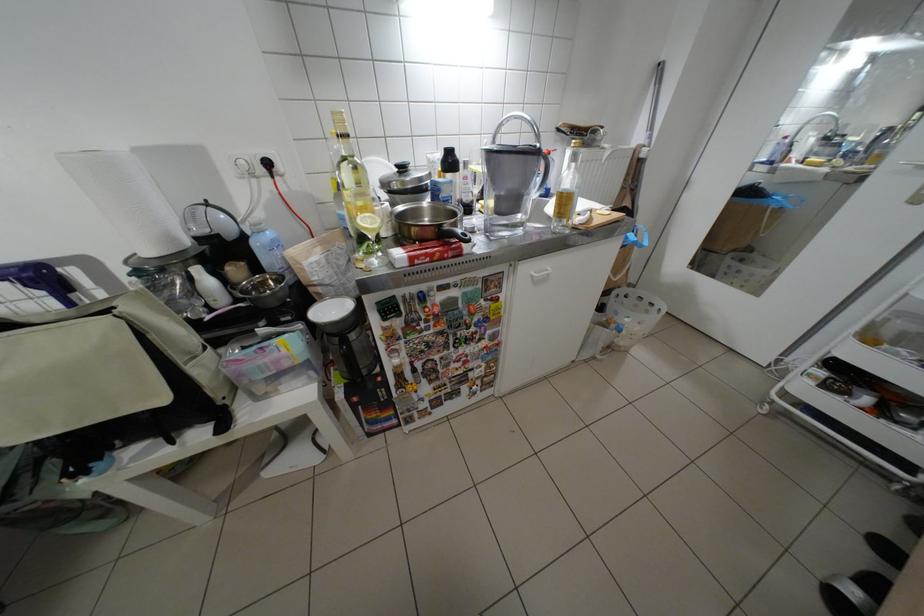
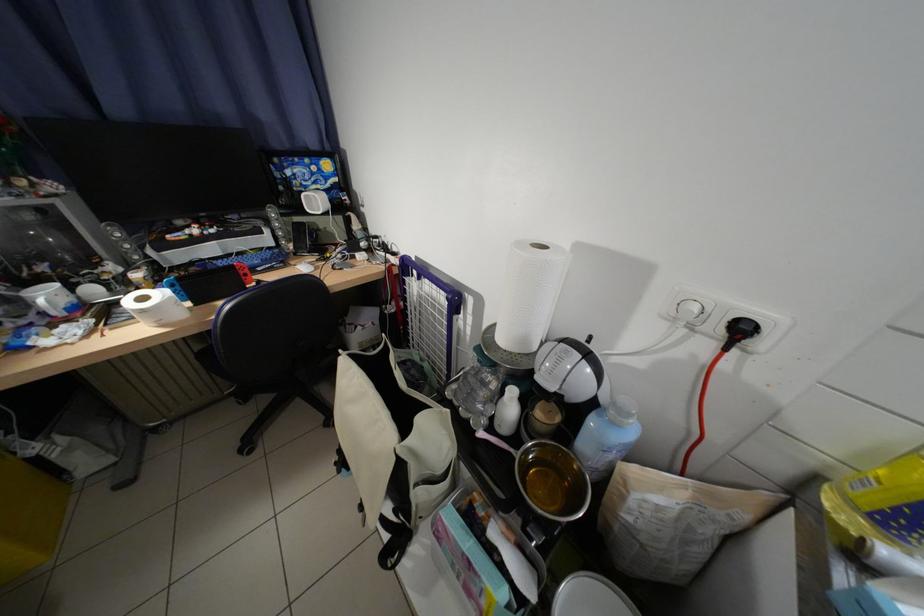
Locate, in the second image, the point that corresponds to (x=201, y=280) in the first image.

(514, 392)